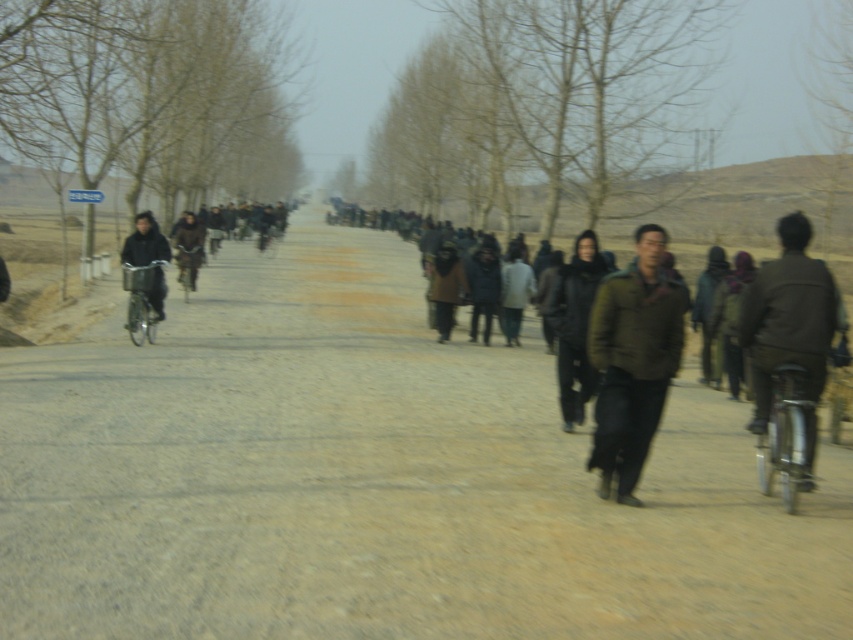
Based on the photo, you are standing at the edge of the dirt road at center and want to walk towards the brown woolen coat at center. Which direction should you move to reach it?

To reach the brown woolen coat at center, you should move backward because the dirt road at center is in front of the brown woolen coat at center, meaning the coat is behind you relative to your current position on the road.

You are a photographer positioned at the end of the dirt road. You want to take a photo that includes both the dark gray wool coat at center and the metallic silver bicycle at left. Which object should be placed closer to the camera to ensure both are fully visible in the frame?

The dark gray wool coat at center should be placed closer to the camera because it is taller than the metallic silver bicycle at left, ensuring both fit within the frame without cropping.